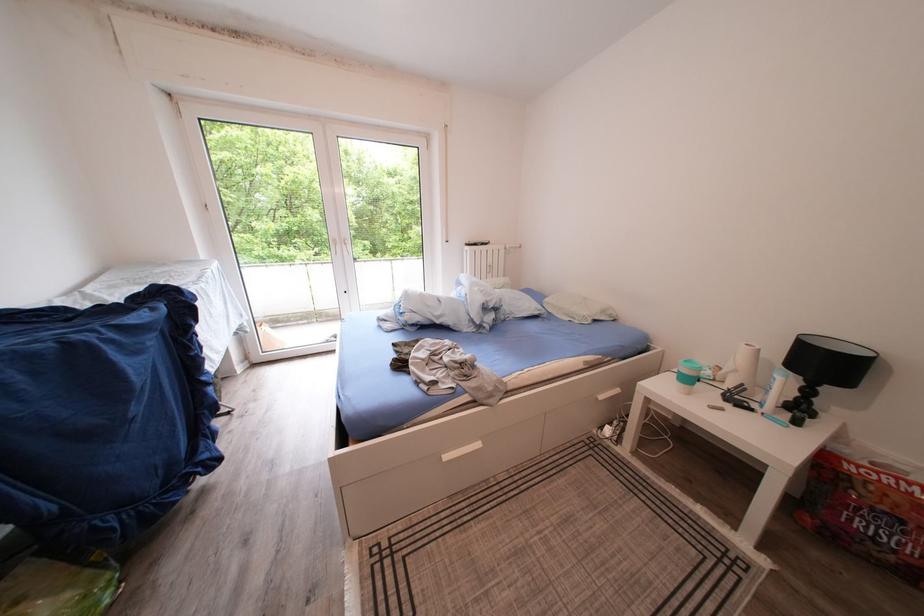
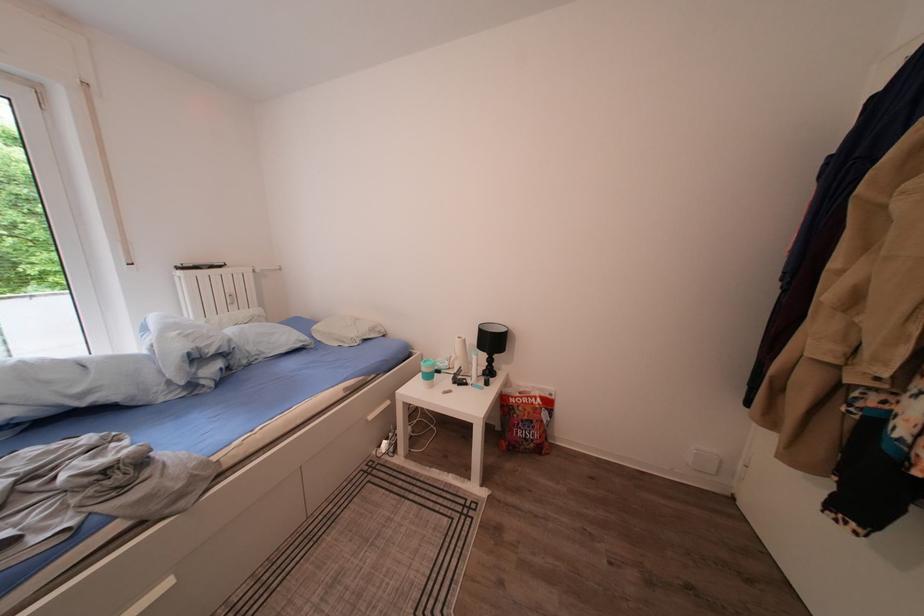
Where in the second image is the point corresponding to point 745,377 from the first image?

(466, 363)